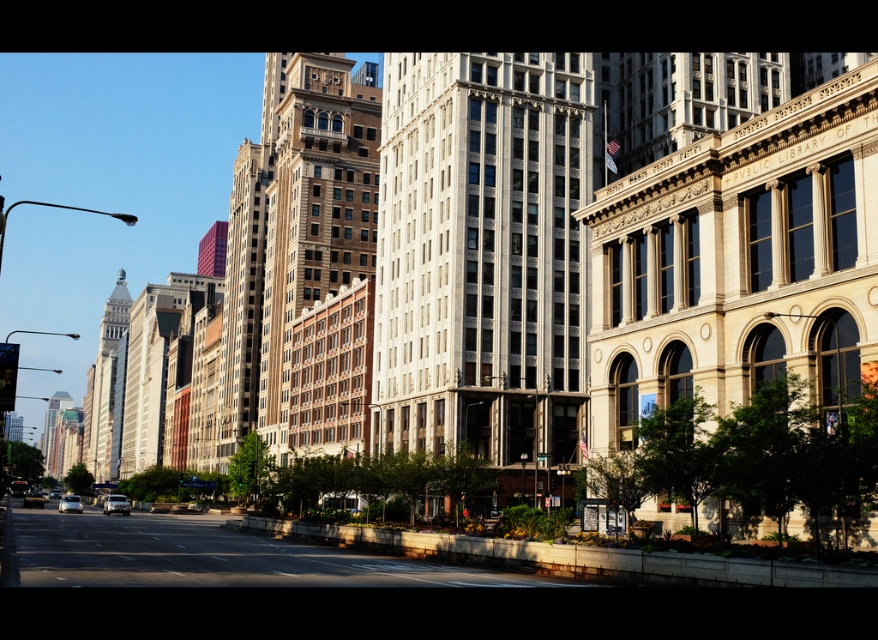
Question: Among these points, which one is farthest from the camera?

Choices:
 (A) (34, 506)
 (B) (114, 499)

Answer: (A)

Question: From the image, what is the correct spatial relationship of metallic silver sedan at lower left in relation to shiny silver car at lower left?

Choices:
 (A) above
 (B) below

Answer: (A)

Question: Where is silver metallic car at lower left located in relation to shiny silver car at lower left in the image?

Choices:
 (A) right
 (B) left

Answer: (A)

Question: Can you confirm if silver metallic car at lower left is positioned below metallic silver sedan at lower left?

Choices:
 (A) yes
 (B) no

Answer: (B)

Question: Which object is closer to the camera taking this photo?

Choices:
 (A) metallic silver sedan at lower left
 (B) shiny silver car at lower left
 (C) silver metallic car at lower left

Answer: (C)

Question: Which point is farther from the camera taking this photo?

Choices:
 (A) (70, 508)
 (B) (119, 502)
 (C) (36, 499)

Answer: (C)